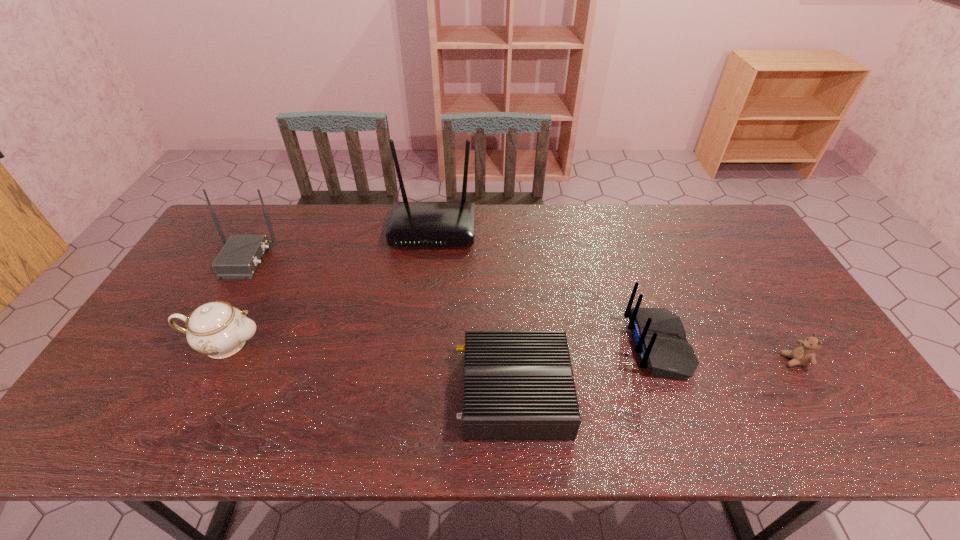
Image resolution: width=960 pixels, height=540 pixels. In order to click on the tallest router in this screenshot , I will do `click(411, 224)`.

At what (x,y) coordinates should I click in order to perform the action: click on the leftmost router. Please return your answer as a coordinate pair (x, y). This screenshot has width=960, height=540. Looking at the image, I should click on (239, 258).

Where is `the second tallest router`? This screenshot has height=540, width=960. the second tallest router is located at coordinates (239, 258).

Identify the location of the second shortest router. (659, 337).

Locate an element on the screen. This screenshot has height=540, width=960. the second object from right to left is located at coordinates (659, 337).

At what (x,y) coordinates should I click in order to perform the action: click on chinaware. Please return your answer as a coordinate pair (x, y). Looking at the image, I should click on (216, 329).

This screenshot has height=540, width=960. What are the coordinates of `the rightmost object` in the screenshot? It's located at (804, 353).

The image size is (960, 540). What are the coordinates of `the shortest router` in the screenshot? It's located at (518, 385).

This screenshot has height=540, width=960. Identify the location of blank space located on the front-facing side of the tallest router. (425, 293).

What are the coordinates of `free space located 0.050m on the back of the leftmost router to connect cables` in the screenshot? It's located at (288, 259).